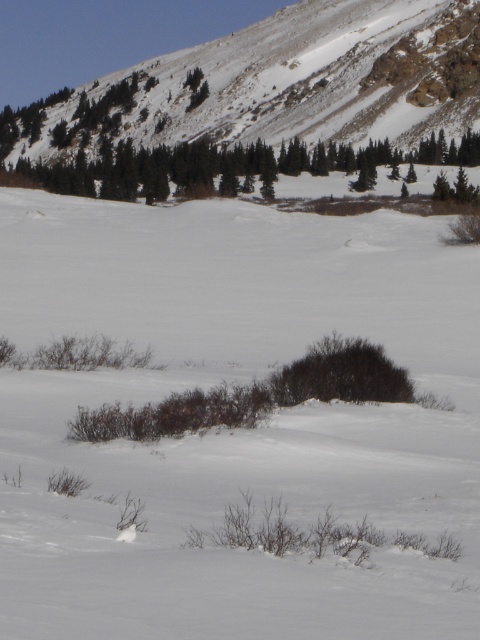
Question: Among these points, which one is nearest to the camera?

Choices:
 (A) (204, 113)
 (B) (40, 561)

Answer: (B)

Question: Which of the following is the closest to the observer?

Choices:
 (A) white fluffy snow at center
 (B) snowy rock at upper center

Answer: (A)

Question: Can you confirm if white fluffy snow at center is positioned below snowy rock at upper center?

Choices:
 (A) no
 (B) yes

Answer: (B)

Question: Can you confirm if white fluffy snow at center is positioned below snowy rock at upper center?

Choices:
 (A) no
 (B) yes

Answer: (B)

Question: Does white fluffy snow at center have a smaller size compared to snowy rock at upper center?

Choices:
 (A) no
 (B) yes

Answer: (B)